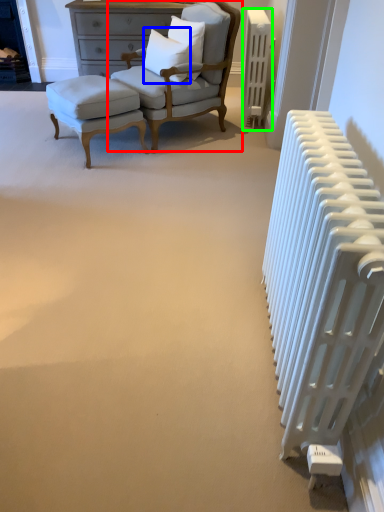
Question: Which is nearer to the chair (highlighted by a red box)? pillow (highlighted by a blue box) or radiator (highlighted by a green box).

Choices:
 (A) pillow
 (B) radiator

Answer: (A)